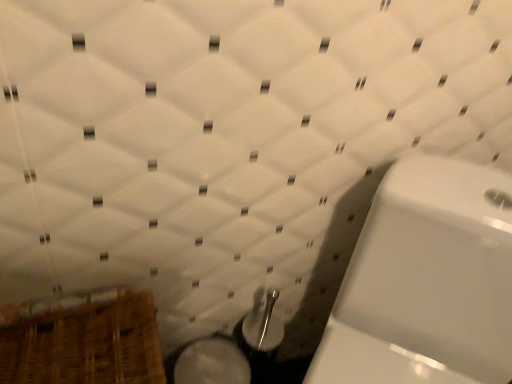
Question: From the image's perspective, relative to white glossy toilet at right, is white glossy bidet at lower center above or below?

Choices:
 (A) below
 (B) above

Answer: (A)

Question: Is white glossy bidet at lower center situated inside white glossy toilet at right or outside?

Choices:
 (A) inside
 (B) outside

Answer: (B)

Question: Which is nearer to the wooden basket at lower left?

Choices:
 (A) white glossy bidet at lower center
 (B) white glossy toilet at right

Answer: (A)

Question: Which object is the closest to the white glossy bidet at lower center?

Choices:
 (A) wooden basket at lower left
 (B) white glossy toilet at right

Answer: (A)